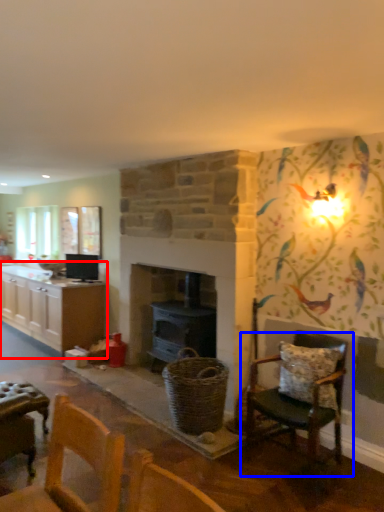
Question: Which point is closer to the camera, cabinetry (highlighted by a red box) or chair (highlighted by a blue box)?

Choices:
 (A) cabinetry
 (B) chair

Answer: (B)